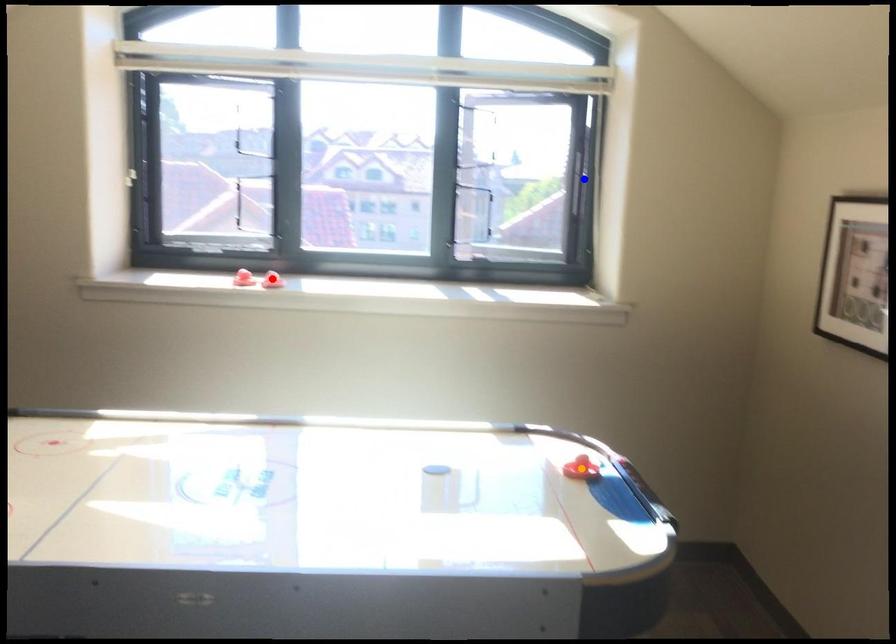
In the scene shown: Order these from farthest to nearest:
1. orange point
2. blue point
3. red point

1. blue point
2. red point
3. orange point